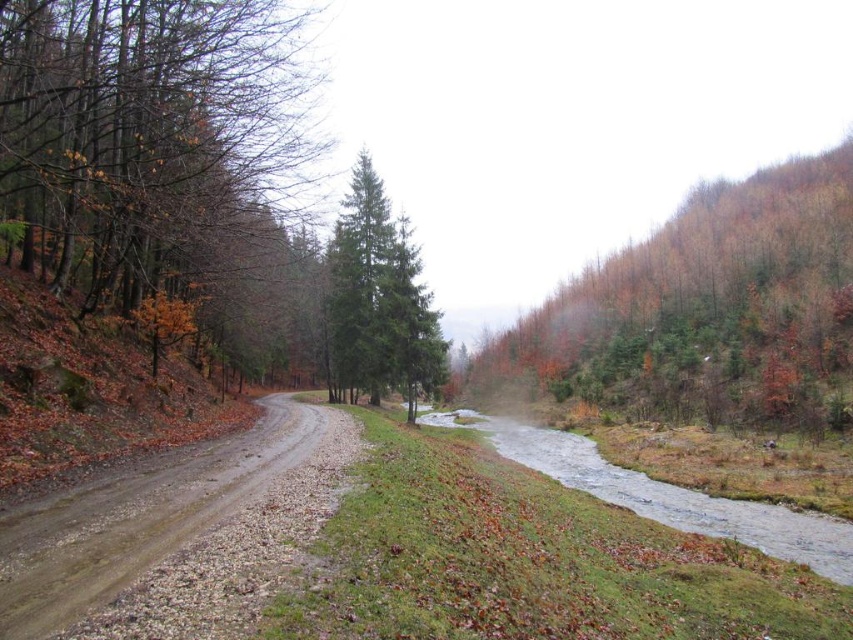
Question: In this image, where is brown matte tree at left located relative to brown gravel road at left?

Choices:
 (A) below
 (B) above

Answer: (B)

Question: Can you confirm if brown gravel road at left is positioned above green matte tree at center?

Choices:
 (A) yes
 (B) no

Answer: (B)

Question: Among these objects, which one is nearest to the camera?

Choices:
 (A) brown matte tree at left
 (B) green matte tree at center
 (C) clear water at center

Answer: (A)

Question: Among these objects, which one is nearest to the camera?

Choices:
 (A) brown gravel road at left
 (B) clear water at center
 (C) green matte tree at center
 (D) brown matte tree at left

Answer: (A)

Question: Which of the following is the farthest from the observer?

Choices:
 (A) brown gravel road at left
 (B) clear water at center
 (C) brown matte tree at left

Answer: (B)

Question: Can you confirm if brown gravel road at left is bigger than clear water at center?

Choices:
 (A) yes
 (B) no

Answer: (B)